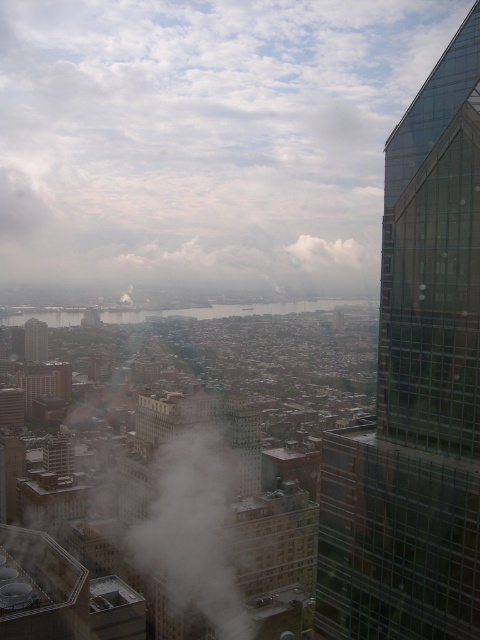
Question: Is white fluffy cloud at center to the right of matte glass skyscraper at center-left from the viewer's perspective?

Choices:
 (A) no
 (B) yes

Answer: (B)

Question: Does white fluffy cloud at upper center have a lesser width compared to transparent glass skyscraper at right?

Choices:
 (A) no
 (B) yes

Answer: (A)

Question: Which object is the closest to the transparent glass skyscraper at right?

Choices:
 (A) white fluffy cloud at center
 (B) white fluffy cloud at upper center

Answer: (A)

Question: Which object is farther from the camera taking this photo?

Choices:
 (A) white fluffy cloud at center
 (B) transparent glass skyscraper at right
 (C) matte glass skyscraper at center-left
 (D) white fluffy cloud at upper center

Answer: (C)

Question: Estimate the real-world distances between objects in this image. Which object is farther from the matte glass skyscraper at center-left?

Choices:
 (A) white fluffy cloud at center
 (B) white fluffy cloud at upper center

Answer: (A)

Question: Does white fluffy cloud at upper center appear on the right side of transparent glass skyscraper at right?

Choices:
 (A) no
 (B) yes

Answer: (A)